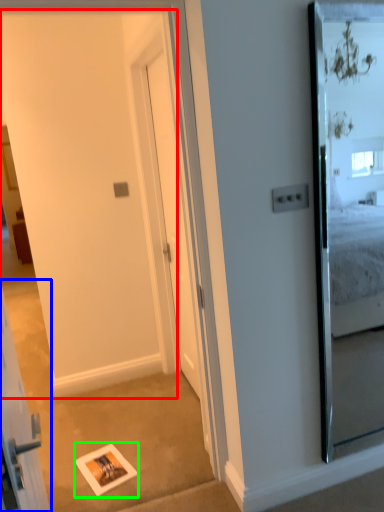
Question: Which object is the closest to the barn door (highlighted by a red box)? Choose among these: elevator (highlighted by a blue box) or picture frame (highlighted by a green box).

Choices:
 (A) elevator
 (B) picture frame

Answer: (B)